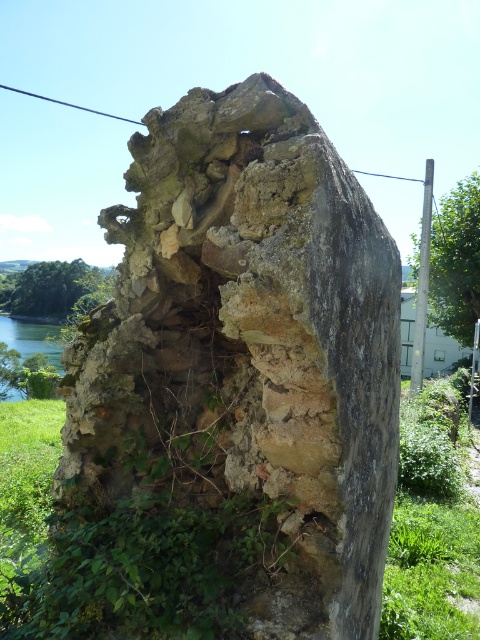
You are a bird flying over the scene and want to land on the green leafy vegetation at right or the green water at left. Which location allows you to land safely without sinking?

The green leafy vegetation at right has a greater height compared to green water at left, so landing on the green leafy vegetation at right is safer as it provides a solid surface, whereas the green water at left may cause sinking.

You are a painter standing in front of the weathered stone wall at center and the green water at left. You want to paint both scenes on a canvas. Which object should you paint first to ensure proper perspective, considering their sizes in the image?

The weathered stone wall at center should be painted first because it is smaller than the green water at left, so starting with the smaller object allows for better perspective adjustments as you move to larger elements.

You are a photographer standing in front of the weathered stone structure. You notice the green leafy vegetation at left and the green water at left in the background. Which object is closer to you?

The green leafy vegetation at left is closer to you because it is in front of the green water at left.